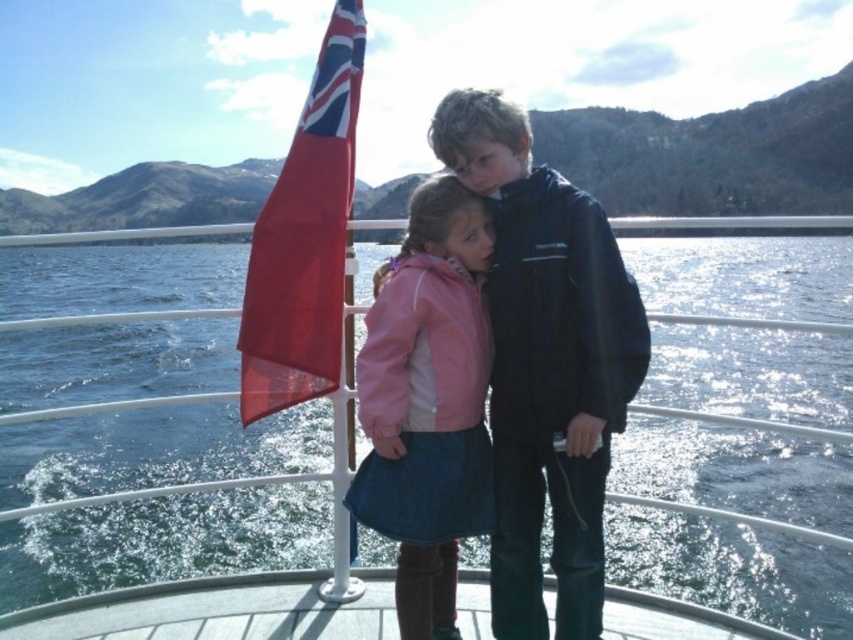
Which is below, pink matte jacket at center or pink fabric jacket at center?

Positioned lower is pink fabric jacket at center.

This screenshot has height=640, width=853. I want to click on pink matte jacket at center, so click(546, 364).

Can you confirm if pink matte jacket at center is positioned below smooth wooden deck at center?

Incorrect, pink matte jacket at center is not positioned below smooth wooden deck at center.

Is point (575, 400) behind point (114, 595)?

That is False.

Which is in front, point (511, 220) or point (267, 634)?

Point (511, 220) is in front.

The width and height of the screenshot is (853, 640). In order to click on pink matte jacket at center in this screenshot , I will do `click(546, 364)`.

Is point (276, 250) behind point (199, 605)?

That is False.

Can you confirm if red fabric flag at left is smaller than smooth wooden deck at center?

Actually, red fabric flag at left might be larger than smooth wooden deck at center.

The height and width of the screenshot is (640, 853). In order to click on red fabric flag at left in this screenshot , I will do (305, 237).